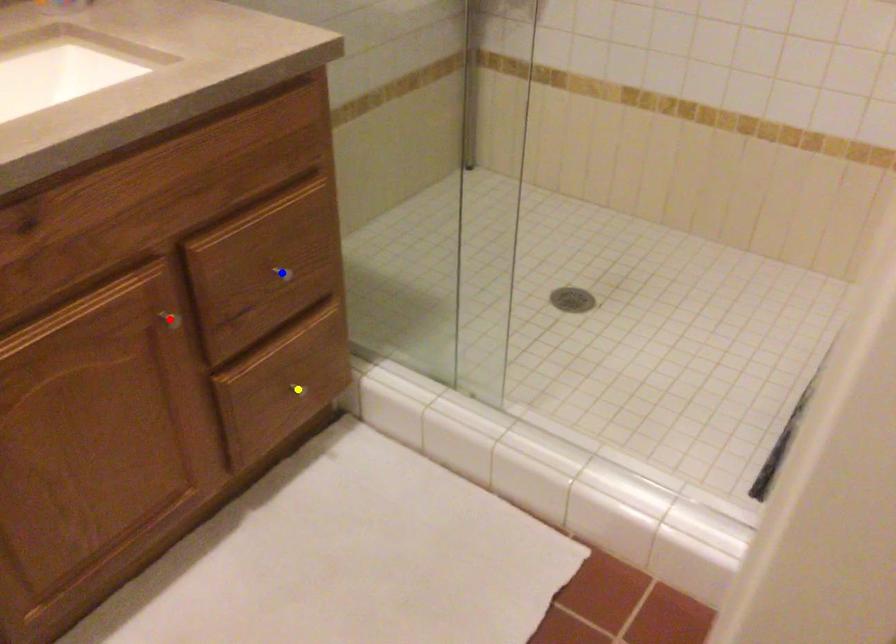
Looking at this image, order these from nearest to farthest:
A) yellow point
B) red point
C) blue point

red point, blue point, yellow point